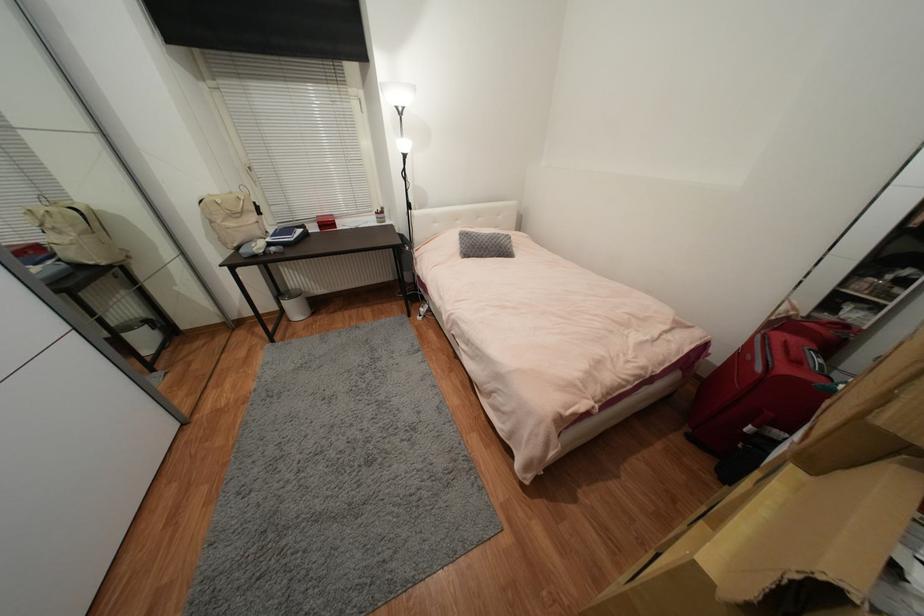
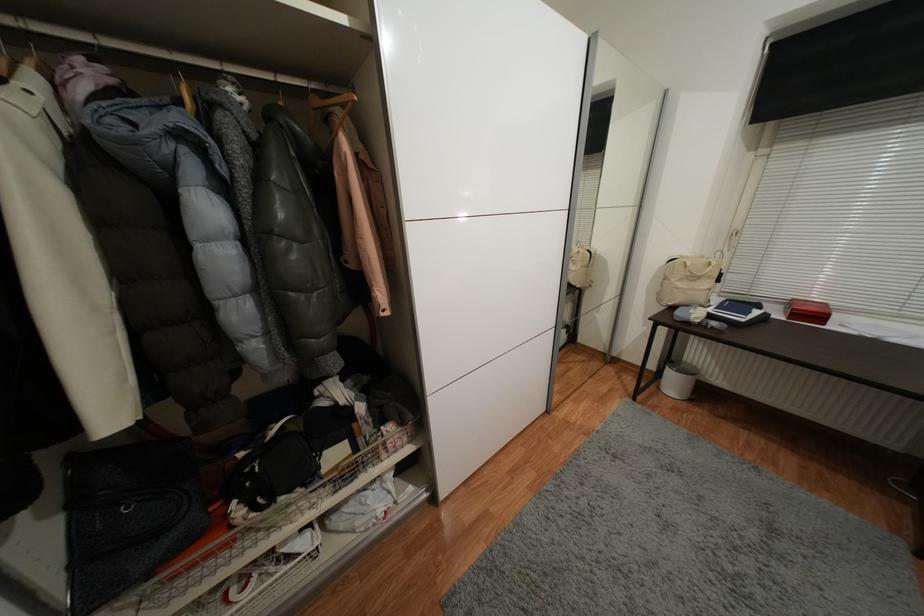
The point at (294, 322) is marked in the first image. Where is the corresponding point in the second image?

(663, 390)